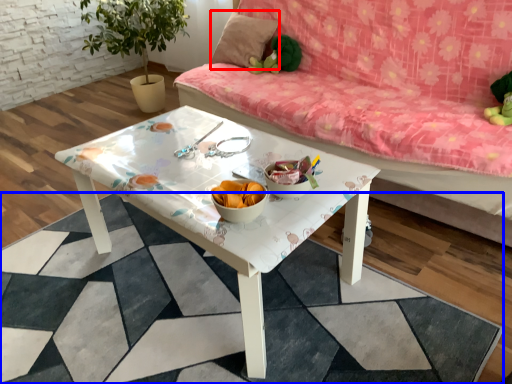
Question: Which of the following is the farthest to the observer, pillow (highlighted by a red box) or square (highlighted by a blue box)?

Choices:
 (A) pillow
 (B) square

Answer: (A)